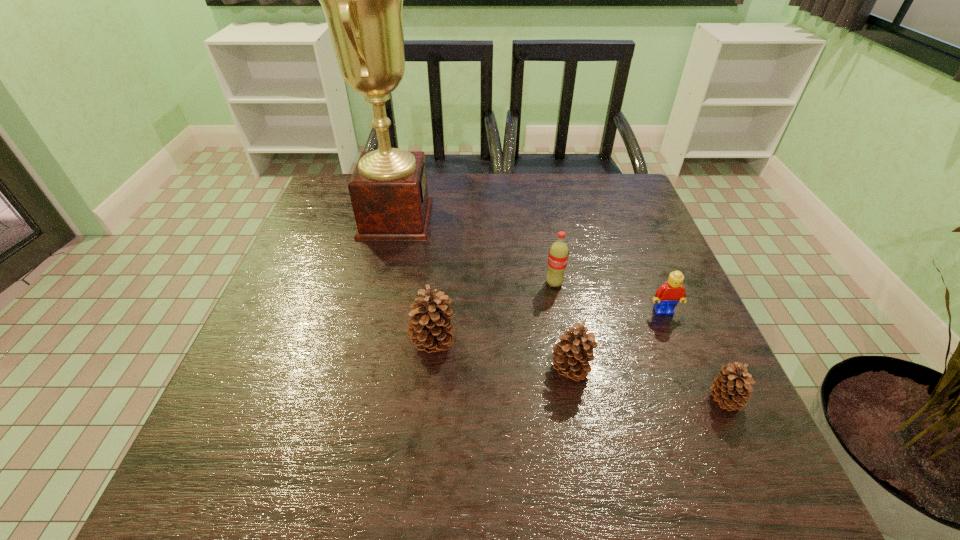
This screenshot has height=540, width=960. I want to click on free space at the far edge, so click(x=458, y=176).

Where is `vacant space at the near edge of the desktop`? This screenshot has width=960, height=540. vacant space at the near edge of the desktop is located at coordinates (476, 429).

Locate an element on the screen. The height and width of the screenshot is (540, 960). vacant space at the left edge of the desktop is located at coordinates (347, 268).

I want to click on free space at the right edge of the desktop, so click(x=685, y=319).

The image size is (960, 540). Identify the location of unoccupied position between the tallest pinecone and the tallest object. tap(414, 281).

You are a GUI agent. You are given a task and a screenshot of the screen. Output one action in this format:
    pyautogui.click(x=<x>, y=<y>)
    Task: Click on the unoccupied position between the rightmost pinecone and the second pinecone from right to left
    Image resolution: width=960 pixels, height=540 pixels.
    Given the screenshot: What is the action you would take?
    pyautogui.click(x=647, y=384)

Find the location of a particular element. The width and height of the screenshot is (960, 540). free point between the second shortest pinecone and the tallest pinecone is located at coordinates (501, 357).

Where is `unoccupied area between the second tallest pinecone and the rightmost pinecone`? The image size is (960, 540). unoccupied area between the second tallest pinecone and the rightmost pinecone is located at coordinates [x=647, y=384].

Find the location of a particular element. vacant space in between the fifth nearest object and the tallest object is located at coordinates (475, 251).

The height and width of the screenshot is (540, 960). I want to click on free space that is in between the shortest pinecone and the farthest object, so click(x=561, y=309).